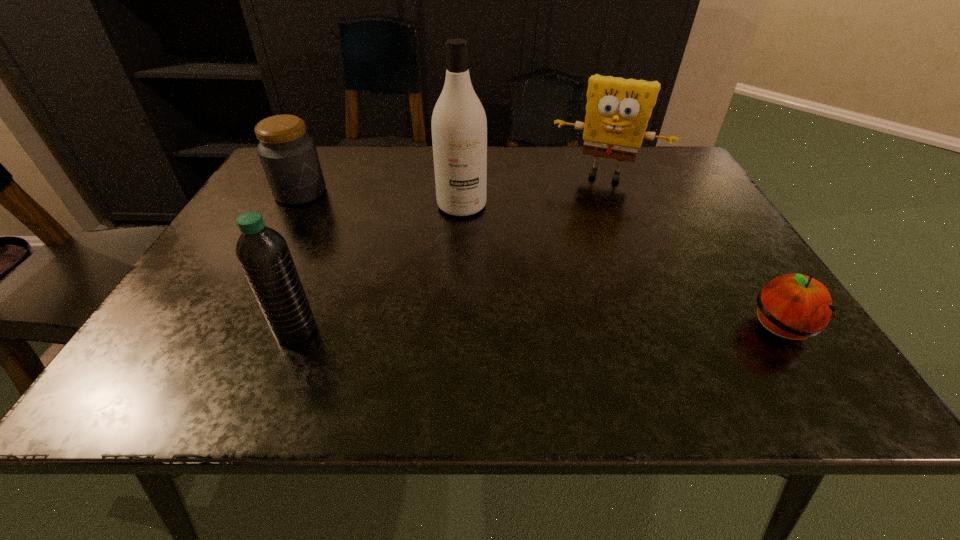
The height and width of the screenshot is (540, 960). I want to click on free spot on the desktop that is between the fourth object from right to left and the rightmost object and is positioned on the front-facing side of the third object from left to right, so click(475, 330).

I want to click on free spot on the desktop that is between the fourth object from right to left and the shortest object and is positioned on the surface of the fourth tallest object near the warning symbol, so click(x=494, y=330).

Locate an element on the screen. vacant space on the desktop that is between the water bottle and the apple and is positioned on the face of the sponge is located at coordinates (558, 330).